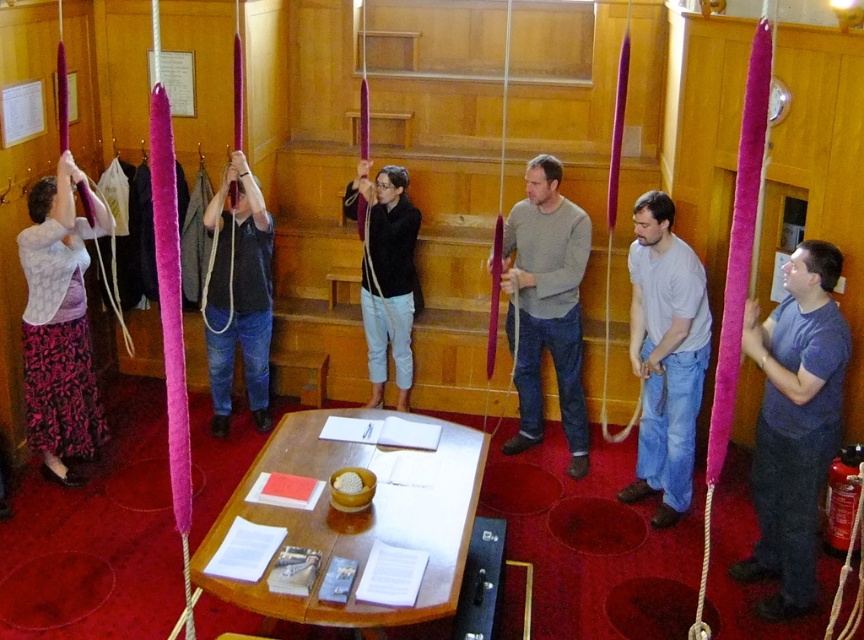
Question: From the image, what is the correct spatial relationship of wooden table at center in relation to matte purple skirt at left?

Choices:
 (A) above
 (B) below

Answer: (B)

Question: Does wooden table at center appear under matte black shirt at center?

Choices:
 (A) yes
 (B) no

Answer: (A)

Question: Which of the following is the closest to the observer?

Choices:
 (A) gray matte shirt at center
 (B) gray sweater at center
 (C) matte purple skirt at left
 (D) blue cotton shirt at right

Answer: (D)

Question: Which of the following is the closest to the observer?

Choices:
 (A) gray sweater at center
 (B) blue cotton shirt at right
 (C) matte black sweater at center
 (D) matte purple skirt at left

Answer: (B)

Question: Is wooden table at center in front of matte purple rope at center?

Choices:
 (A) yes
 (B) no

Answer: (A)

Question: Which point is farther to the camera?

Choices:
 (A) (577, 330)
 (B) (234, 323)
 (C) (461, 429)
 (D) (701, 387)

Answer: (B)